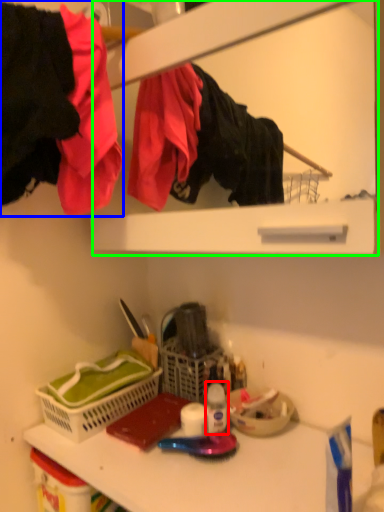
Question: Which is farther away from bottle (highlighted by a red box)? clothing (highlighted by a blue box) or medicine cabinet (highlighted by a green box)?

Choices:
 (A) clothing
 (B) medicine cabinet

Answer: (B)